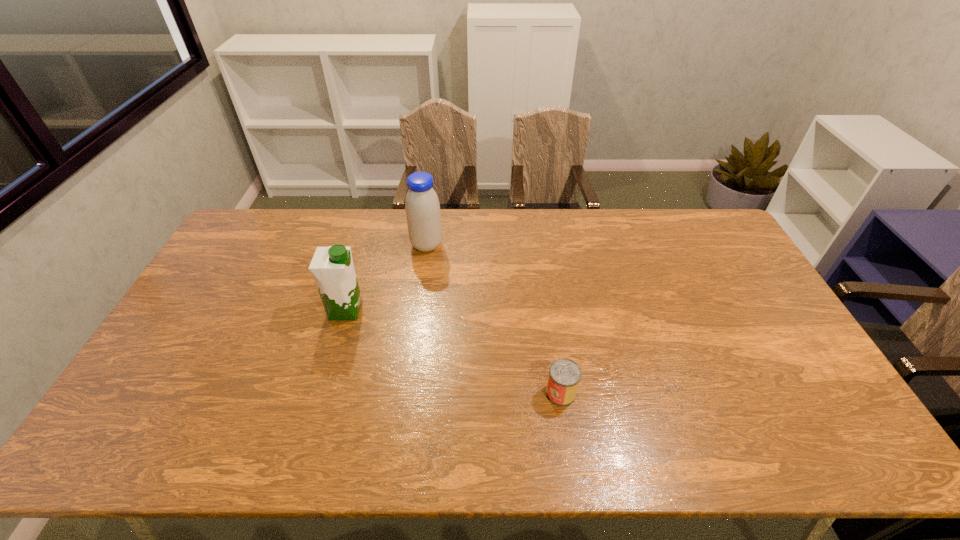
I want to click on vacant space in between the farther soya milk and the shortest object, so click(x=493, y=319).

Locate an element on the screen. The height and width of the screenshot is (540, 960). free space between the rightmost object and the left soya milk is located at coordinates (453, 352).

Image resolution: width=960 pixels, height=540 pixels. Identify the location of free space between the rightmost object and the farthest object. (493, 319).

The width and height of the screenshot is (960, 540). In order to click on vacant point located between the nearest object and the nearer soya milk in this screenshot , I will do `click(453, 352)`.

Locate an element on the screen. empty space that is in between the shortest object and the right soya milk is located at coordinates (493, 319).

Identify the location of free space between the nearest object and the leftmost object. (453, 352).

At what (x,y) coordinates should I click in order to perform the action: click on empty space that is in between the leftmost object and the nearest object. Please return your answer as a coordinate pair (x, y). Looking at the image, I should click on (453, 352).

Locate which object is the closest to the leftmost object. Please provide its 2D coordinates. Your answer should be formatted as a tuple, i.e. [(x, y)], where the tuple contains the x and y coordinates of a point satisfying the conditions above.

[(422, 207)]

Locate which object is the second closest to the left soya milk. Please provide its 2D coordinates. Your answer should be formatted as a tuple, i.e. [(x, y)], where the tuple contains the x and y coordinates of a point satisfying the conditions above.

[(564, 376)]

I want to click on free space that satisfies the following two spatial constraints: 1. on the front side of the farther soya milk; 2. on the front-facing side of the second nearest object, so pyautogui.click(x=418, y=310).